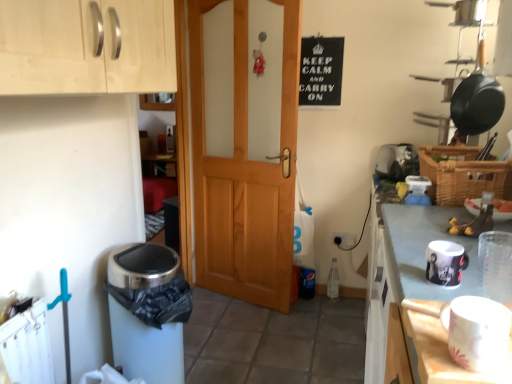
What are the coordinates of `free space on the front side of wooden door at center` in the screenshot? It's located at (251, 338).